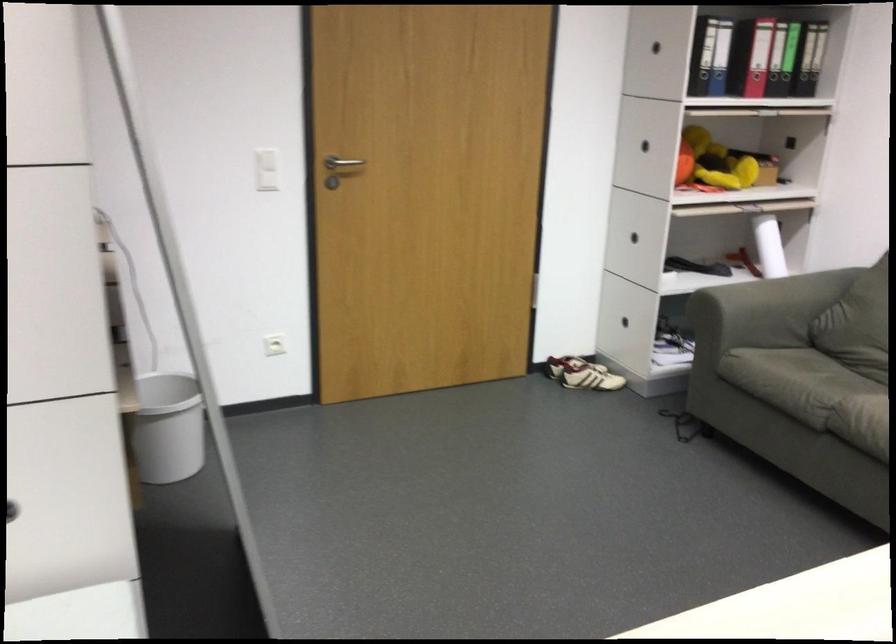
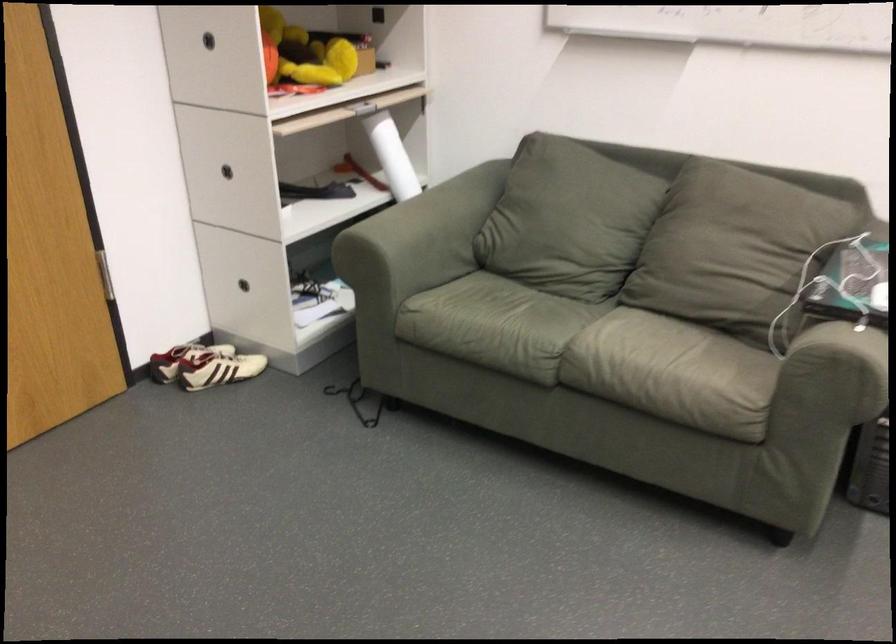
In the second image, find the point that corresponds to the point at 711,149 in the first image.

(303, 53)